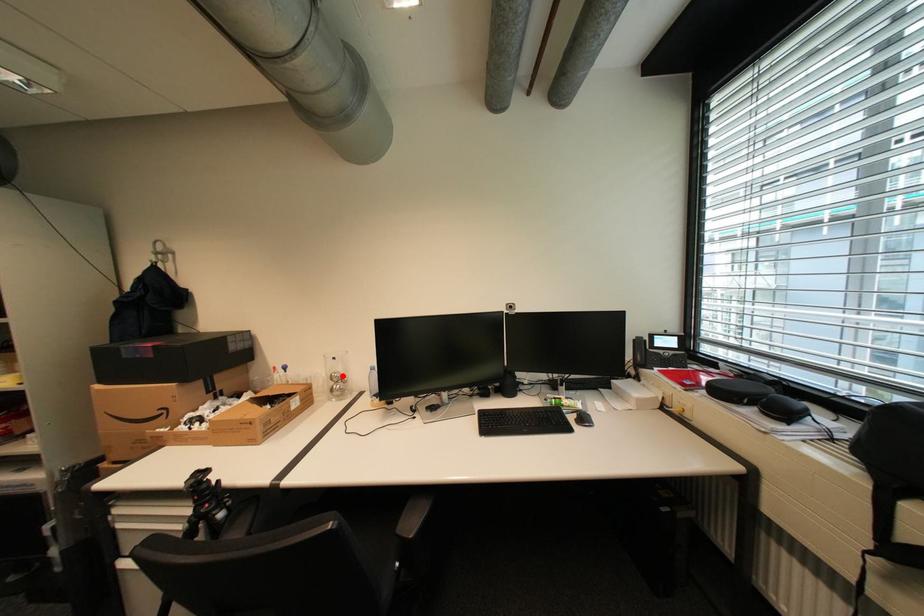
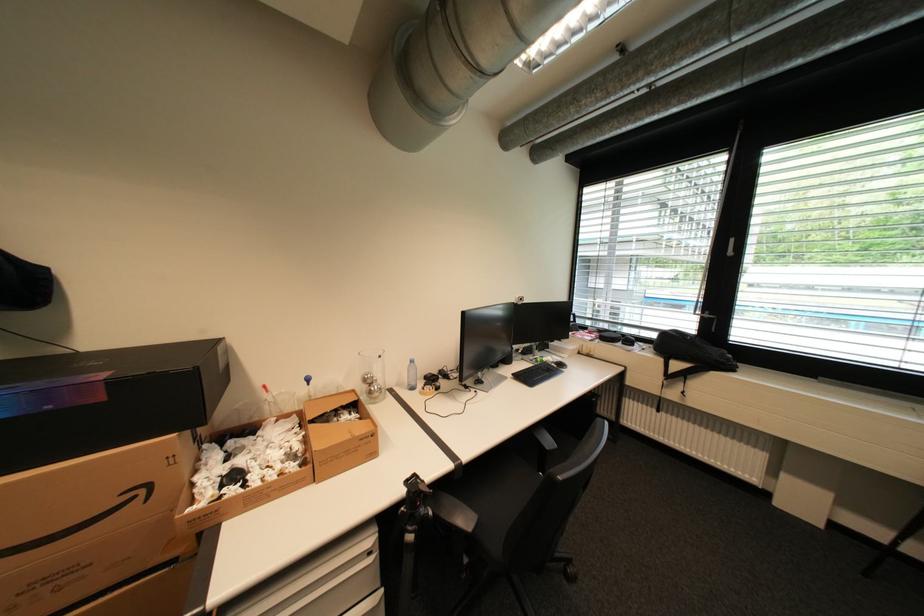
In the second image, find the point that corresponds to the highlighted location in the first image.

(377, 378)